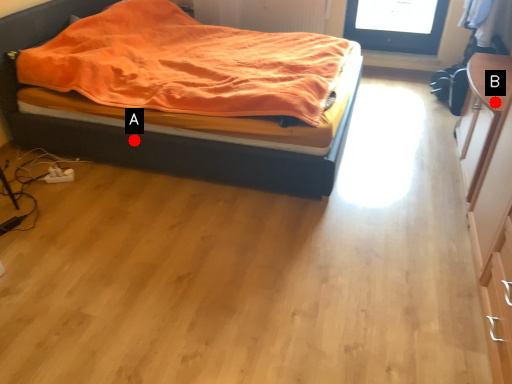
Question: Two points are circled on the image, labeled by A and B beside each circle. Among these points, which one is farthest from the camera?

Choices:
 (A) A is further
 (B) B is further

Answer: (A)